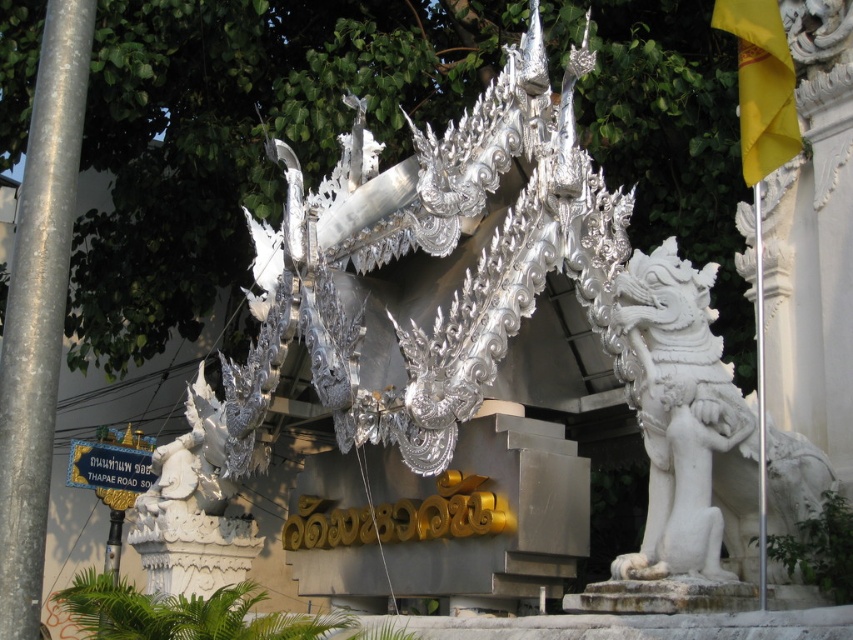
Consider the image. Does silver metallic pole at left appear under gold metallic street sign at lower left?

Incorrect, silver metallic pole at left is not positioned below gold metallic street sign at lower left.

Is point (36, 420) positioned before point (74, 483)?

Yes, point (36, 420) is closer to viewer.

Find the location of a particular element. This screenshot has height=640, width=853. silver metallic pole at left is located at coordinates (38, 308).